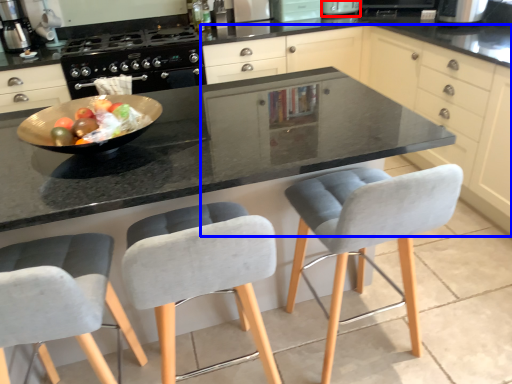
Question: Which object is closer to the camera taking this photo, appliance (highlighted by a red box) or cabinetry (highlighted by a blue box)?

Choices:
 (A) appliance
 (B) cabinetry

Answer: (B)